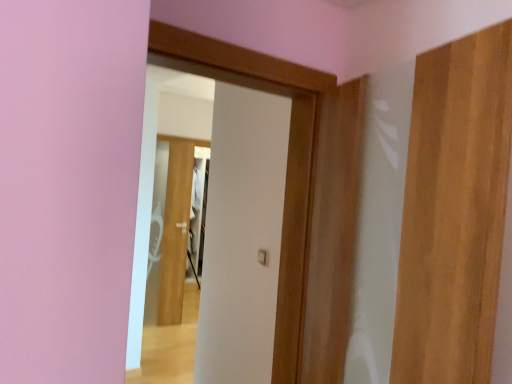
Question: Would you say wooden door at right, positioned as the 3th door in left-to-right order, is inside or outside white matte door at center, which ranks as the second door in left-to-right order?

Choices:
 (A) inside
 (B) outside

Answer: (B)

Question: Considering the relative positions of wooden door at right, positioned as the 3th door in left-to-right order, and white matte door at center, arranged as the second door when viewed from the front, in the image provided, is wooden door at right, positioned as the 3th door in left-to-right order, to the left or to the right of white matte door at center, arranged as the second door when viewed from the front,?

Choices:
 (A) left
 (B) right

Answer: (B)

Question: Which of these objects is positioned closest to the white matte door at center, the 2th door when ordered from back to front?

Choices:
 (A) wooden door at right, the first door viewed from the right
 (B) white glossy door at center, the third door viewed from the front

Answer: (A)

Question: Which object is positioned farthest from the white glossy door at center, the third door viewed from the front?

Choices:
 (A) wooden door at right, which is counted as the first door, starting from the front
 (B) white matte door at center, arranged as the second door when viewed from the front

Answer: (A)